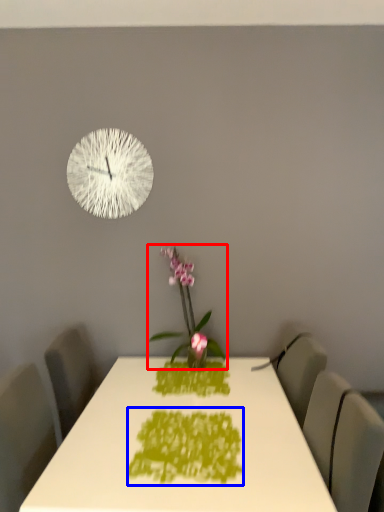
Question: Which object is further to the camera taking this photo, houseplant (highlighted by a red box) or design (highlighted by a blue box)?

Choices:
 (A) houseplant
 (B) design

Answer: (A)